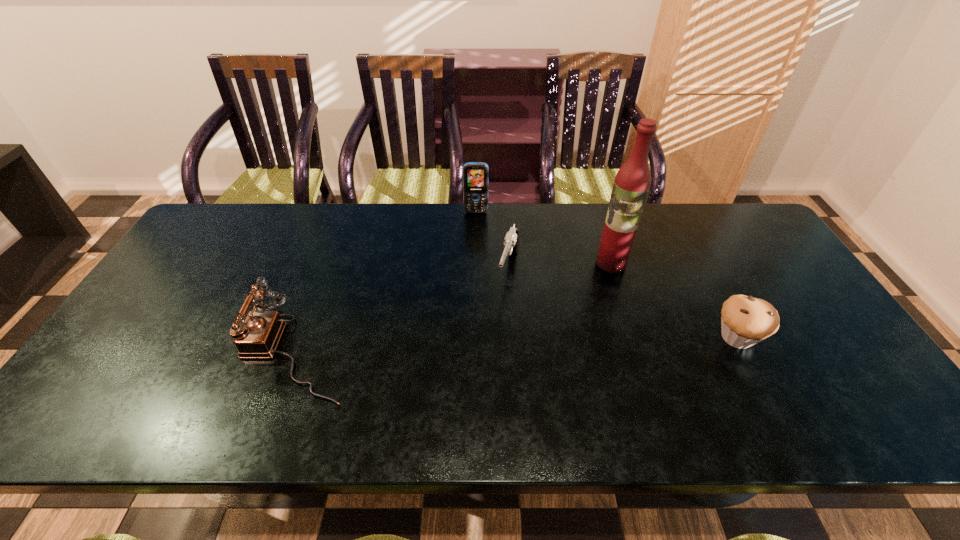
Locate an element on the screen. free space on the desktop that is between the leftmost object and the rightmost object and is positioned on the label of the fourth object from left to right is located at coordinates (559, 343).

Where is `vacant space on the desktop that is between the telephone and the muffin and is positioned on the screen of the farthest object`? The width and height of the screenshot is (960, 540). vacant space on the desktop that is between the telephone and the muffin and is positioned on the screen of the farthest object is located at coordinates (474, 346).

At what (x,y) coordinates should I click in order to perform the action: click on vacant space on the desktop that is between the leftmost object and the rightmost object and is positioned at the muzzle of the third object from right to left. Please return your answer as a coordinate pair (x, y). Looking at the image, I should click on (489, 345).